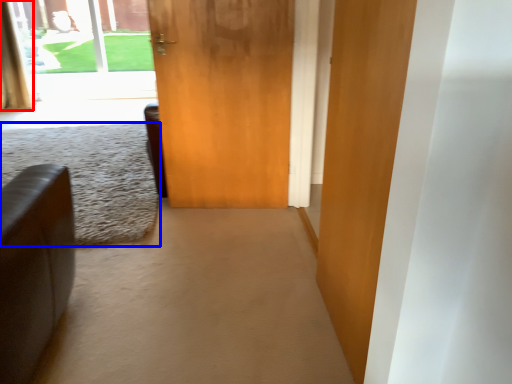
Question: Which object is further to the camera taking this photo, curtain (highlighted by a red box) or plain (highlighted by a blue box)?

Choices:
 (A) curtain
 (B) plain

Answer: (A)